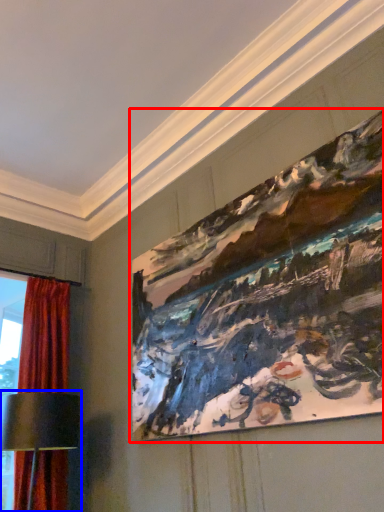
Question: Which of the following is the farthest to the observer, picture frame (highlighted by a red box) or table lamp (highlighted by a blue box)?

Choices:
 (A) picture frame
 (B) table lamp

Answer: (B)